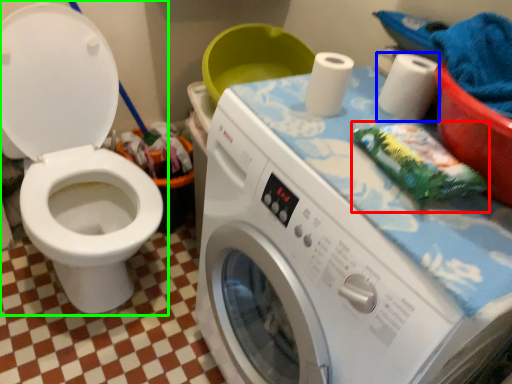
Question: Based on their relative distances, which object is farther from material (highlighted by a red box)? Choose from toilet paper (highlighted by a blue box) and toilet (highlighted by a green box).

Choices:
 (A) toilet paper
 (B) toilet

Answer: (B)